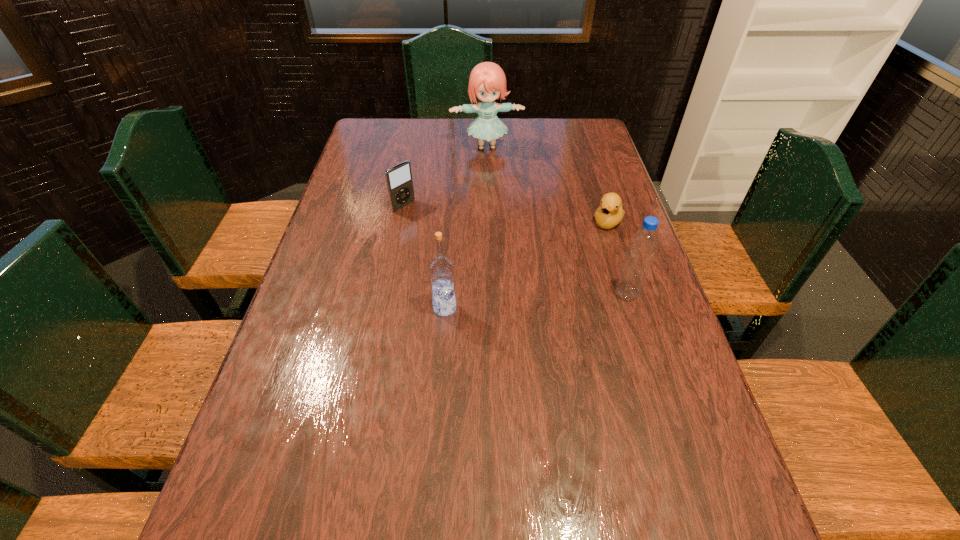
Locate an element on the screen. The height and width of the screenshot is (540, 960). vacant area that lies between the tallest object and the duckling is located at coordinates (547, 184).

You are a GUI agent. You are given a task and a screenshot of the screen. Output one action in this format:
    pyautogui.click(x=<x>, y=<y>)
    Task: Click on the vacant area that lies between the duckling and the leftmost object
    This screenshot has width=960, height=540.
    Given the screenshot: What is the action you would take?
    pyautogui.click(x=506, y=214)

You are a GUI agent. You are given a task and a screenshot of the screen. Output one action in this format:
    pyautogui.click(x=<x>, y=<y>)
    Task: Click on the unoccupied position between the water bottle and the vodka
    
    Given the screenshot: What is the action you would take?
    pyautogui.click(x=536, y=301)

This screenshot has height=540, width=960. In order to click on free space between the duckling and the vodka in this screenshot , I will do (526, 265).

Locate an element on the screen. This screenshot has height=540, width=960. free space between the farthest object and the duckling is located at coordinates (547, 184).

This screenshot has width=960, height=540. Find the location of `vacant space that's between the water bottle and the farthest object`. vacant space that's between the water bottle and the farthest object is located at coordinates [x=557, y=220].

You are a GUI agent. You are given a task and a screenshot of the screen. Output one action in this format:
    pyautogui.click(x=<x>, y=<y>)
    Task: Click on the object that ranks as the second closest to the vodka
    The width and height of the screenshot is (960, 540).
    Given the screenshot: What is the action you would take?
    pyautogui.click(x=642, y=246)

At what (x,y) coordinates should I click in order to perform the action: click on object that ranks as the closest to the vodka. Please return your answer as a coordinate pair (x, y). This screenshot has height=540, width=960. Looking at the image, I should click on (399, 182).

Where is `free region that satisfies the following two spatial constraints: 1. on the front side of the doll; 2. on the right side of the duckling`? This screenshot has height=540, width=960. free region that satisfies the following two spatial constraints: 1. on the front side of the doll; 2. on the right side of the duckling is located at coordinates (489, 221).

Where is `free point that satisfies the following two spatial constraints: 1. on the back side of the duckling; 2. on the left side of the vodka`? The width and height of the screenshot is (960, 540). free point that satisfies the following two spatial constraints: 1. on the back side of the duckling; 2. on the left side of the vodka is located at coordinates (451, 221).